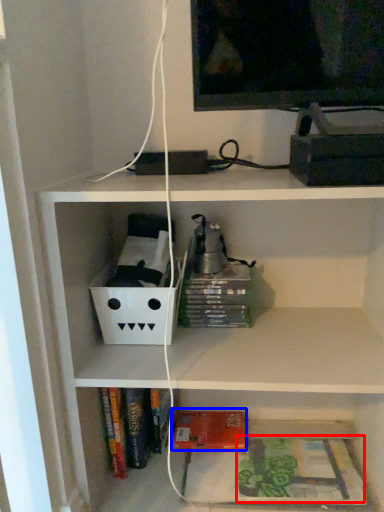
Question: Which object appears closest to the camera in this image, book (highlighted by a red box) or paperback book (highlighted by a blue box)?

Choices:
 (A) book
 (B) paperback book

Answer: (A)